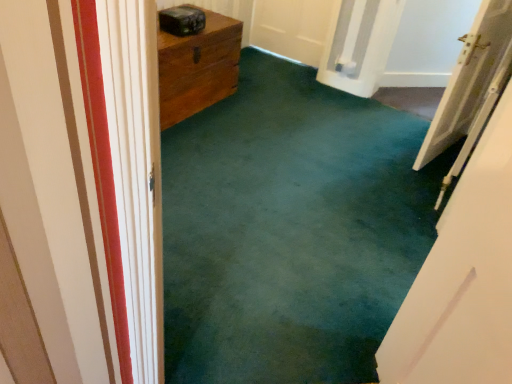
Question: Should I look upward or downward to see white wooden door at right?

Choices:
 (A) down
 (B) up

Answer: (B)

Question: Is white wooden door at right to the left of green carpet at center from the viewer's perspective?

Choices:
 (A) yes
 (B) no

Answer: (B)

Question: Considering the relative sizes of white wooden door at right and green carpet at center in the image provided, is white wooden door at right taller than green carpet at center?

Choices:
 (A) yes
 (B) no

Answer: (B)

Question: From a real-world perspective, does white wooden door at right stand above green carpet at center?

Choices:
 (A) yes
 (B) no

Answer: (B)

Question: Can you confirm if white wooden door at right is thinner than green carpet at center?

Choices:
 (A) yes
 (B) no

Answer: (A)

Question: Is there a large distance between white wooden door at right and green carpet at center?

Choices:
 (A) yes
 (B) no

Answer: (B)

Question: Could you tell me if white wooden door at right is facing green carpet at center?

Choices:
 (A) no
 (B) yes

Answer: (A)

Question: Is green carpet at center behind white wooden door at right?

Choices:
 (A) yes
 (B) no

Answer: (B)

Question: From the image's perspective, is green carpet at center over white wooden door at right?

Choices:
 (A) no
 (B) yes

Answer: (A)

Question: Is green carpet at center wider than white wooden door at right?

Choices:
 (A) yes
 (B) no

Answer: (A)

Question: Could you tell me if green carpet at center is turned towards white wooden door at right?

Choices:
 (A) yes
 (B) no

Answer: (B)

Question: Considering the relative positions of green carpet at center and white wooden door at right in the image provided, is green carpet at center to the right of white wooden door at right from the viewer's perspective?

Choices:
 (A) no
 (B) yes

Answer: (A)

Question: Could white wooden door at right be considered to be inside green carpet at center?

Choices:
 (A) no
 (B) yes

Answer: (A)

Question: From the image's perspective, is green carpet at center positioned above or below white wooden door at right?

Choices:
 (A) below
 (B) above

Answer: (A)